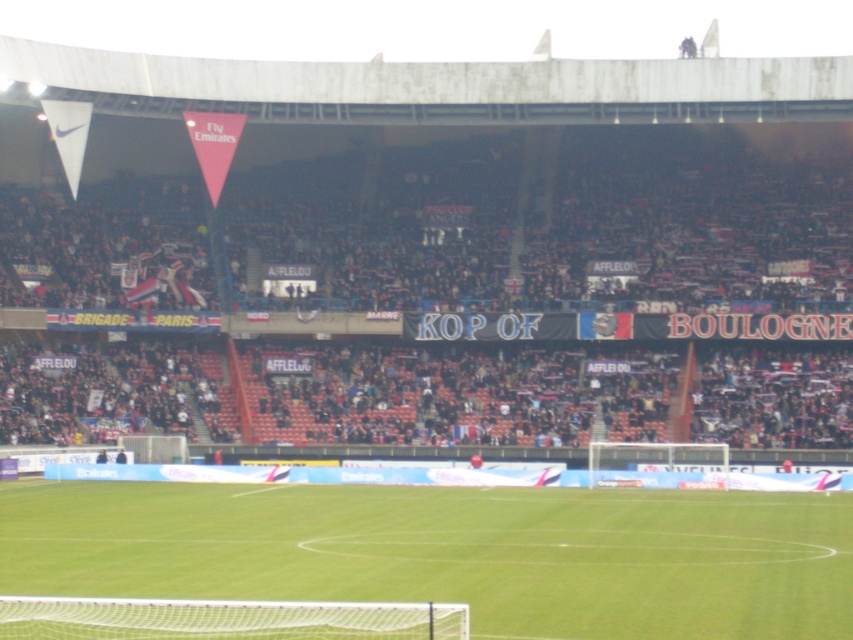
Question: Can you confirm if dark brown wooden bench at lower center is positioned to the right of green grass football field at center?

Choices:
 (A) no
 (B) yes

Answer: (A)

Question: Which point is farther to the camera?

Choices:
 (A) (735, 588)
 (B) (779, 184)

Answer: (B)

Question: Among these objects, which one is farthest from the camera?

Choices:
 (A) dark brown wooden bench at lower center
 (B) green grass football field at center

Answer: (A)

Question: Is dark brown wooden bench at lower center below green grass football field at center?

Choices:
 (A) yes
 (B) no

Answer: (B)

Question: Is dark brown wooden bench at lower center positioned at the back of green grass football field at center?

Choices:
 (A) no
 (B) yes

Answer: (B)